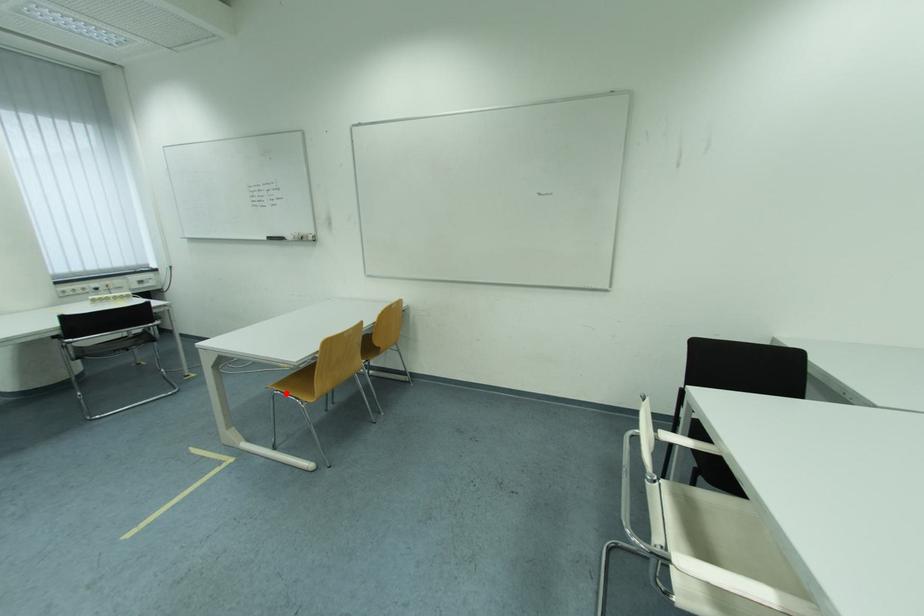
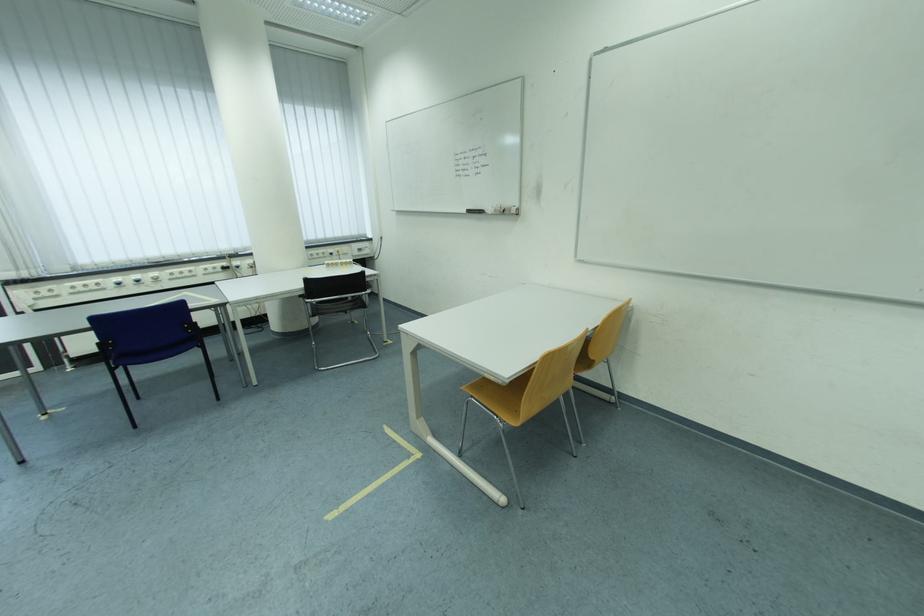
Where in the second image is the point corresponding to the highlighted location from the first image?

(481, 398)